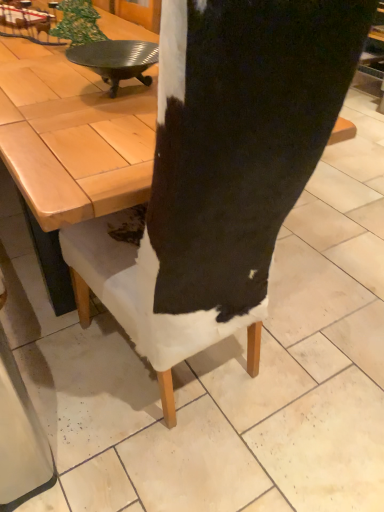
Find the location of a particular element. vacant space underneath metallic silver plate at upper left (from a real-world perspective) is located at coordinates (118, 90).